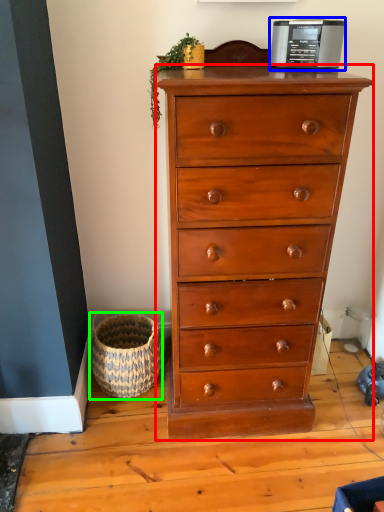
Question: Based on their relative distances, which object is nearer to chest of drawers (highlighted by a red box)? Choose from appliance (highlighted by a blue box) and basket (highlighted by a green box).

Choices:
 (A) appliance
 (B) basket

Answer: (B)